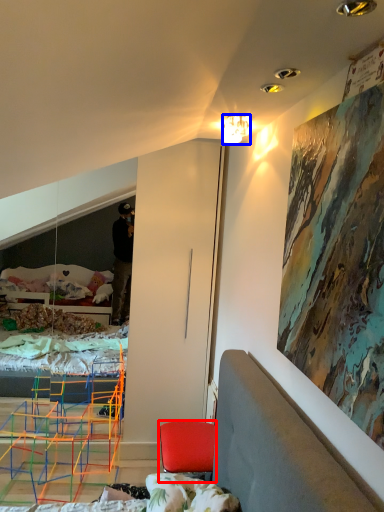
Question: Which object is further to the camera taking this photo, chair (highlighted by a red box) or lamp (highlighted by a blue box)?

Choices:
 (A) chair
 (B) lamp

Answer: (A)